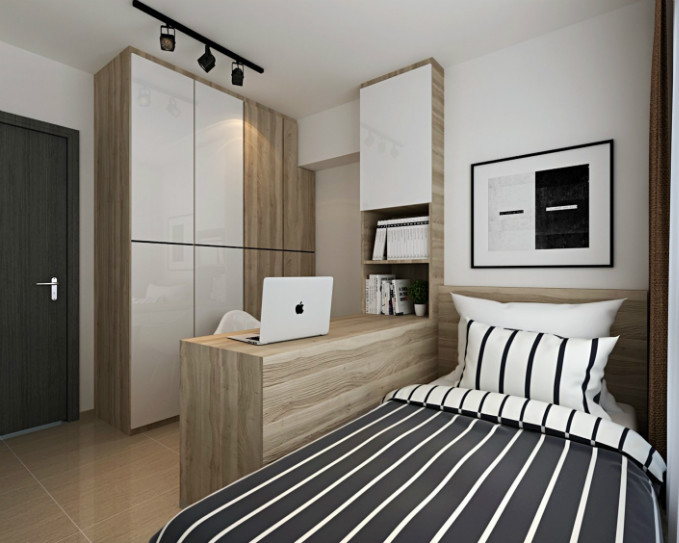
You are a GUI agent. You are given a task and a screenshot of the screen. Output one action in this format:
    pyautogui.click(x=<x>, y=<y>)
    Task: Click on the cupboard
    
    Given the screenshot: What is the action you would take?
    pyautogui.click(x=409, y=141), pyautogui.click(x=220, y=157), pyautogui.click(x=155, y=168), pyautogui.click(x=158, y=296), pyautogui.click(x=218, y=274), pyautogui.click(x=273, y=189), pyautogui.click(x=272, y=265)